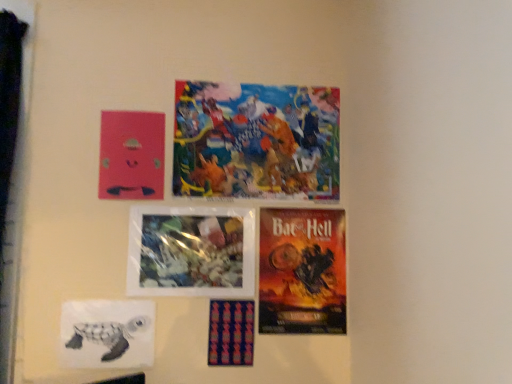
Question: Does pink matte poster at upper left, which is counted as the 5th poster, starting from the bottom, have a larger size compared to orange matte poster at lower right, positioned as the 4th poster in top-to-bottom order?

Choices:
 (A) yes
 (B) no

Answer: (B)

Question: Can you confirm if pink matte poster at upper left, which is counted as the 5th poster, starting from the bottom, is shorter than orange matte poster at lower right, acting as the 3th poster starting from the bottom?

Choices:
 (A) no
 (B) yes

Answer: (B)

Question: From a real-world perspective, is pink matte poster at upper left, which is counted as the 5th poster, starting from the bottom, on orange matte poster at lower right, positioned as the 4th poster in top-to-bottom order?

Choices:
 (A) yes
 (B) no

Answer: (A)

Question: Considering the relative positions of pink matte poster at upper left, which is counted as the 5th poster, starting from the bottom, and orange matte poster at lower right, positioned as the 4th poster in top-to-bottom order, in the image provided, is pink matte poster at upper left, which is counted as the 5th poster, starting from the bottom, in front of orange matte poster at lower right, positioned as the 4th poster in top-to-bottom order,?

Choices:
 (A) no
 (B) yes

Answer: (B)

Question: Is pink matte poster at upper left, which is counted as the 5th poster, starting from the bottom, not within orange matte poster at lower right, positioned as the 4th poster in top-to-bottom order?

Choices:
 (A) no
 (B) yes

Answer: (B)

Question: In the image, is translucent plastic flowers at center, the third poster when ordered from top to bottom, positioned in front of or behind colorful collage at upper center, marked as the sixth poster in a bottom-to-top arrangement?

Choices:
 (A) behind
 (B) front

Answer: (B)

Question: Is translucent plastic flowers at center, which ranks as the 4th poster in bottom-to-top order, inside or outside of colorful collage at upper center, marked as the sixth poster in a bottom-to-top arrangement?

Choices:
 (A) inside
 (B) outside

Answer: (B)

Question: Looking at their shapes, would you say translucent plastic flowers at center, which ranks as the 4th poster in bottom-to-top order, is wider or thinner than colorful collage at upper center, the first poster viewed from the top?

Choices:
 (A) thin
 (B) wide

Answer: (B)

Question: From a real-world perspective, is translucent plastic flowers at center, the third poster when ordered from top to bottom, positioned above or below colorful collage at upper center, marked as the sixth poster in a bottom-to-top arrangement?

Choices:
 (A) below
 (B) above

Answer: (A)

Question: Visually, is translucent plastic flowers at center, which ranks as the 4th poster in bottom-to-top order, positioned to the left or to the right of pink matte poster at upper left, which is counted as the 5th poster, starting from the bottom?

Choices:
 (A) left
 (B) right

Answer: (B)

Question: Is translucent plastic flowers at center, the third poster when ordered from top to bottom, taller or shorter than pink matte poster at upper left, which is counted as the 5th poster, starting from the bottom?

Choices:
 (A) short
 (B) tall

Answer: (A)

Question: In terms of size, does translucent plastic flowers at center, which ranks as the 4th poster in bottom-to-top order, appear bigger or smaller than pink matte poster at upper left, which is counted as the 5th poster, starting from the bottom?

Choices:
 (A) small
 (B) big

Answer: (B)

Question: Is translucent plastic flowers at center, which ranks as the 4th poster in bottom-to-top order, wider or thinner than pink matte poster at upper left, which is counted as the 5th poster, starting from the bottom?

Choices:
 (A) thin
 (B) wide

Answer: (B)

Question: Does point click(x=229, y=365) appear closer or farther from the camera than point click(x=105, y=178)?

Choices:
 (A) closer
 (B) farther

Answer: (A)

Question: From their relative heights in the image, would you say textured fabric poster at center, the sixth poster from the top, is taller or shorter than pink matte poster at upper left, acting as the second poster starting from the top?

Choices:
 (A) short
 (B) tall

Answer: (A)